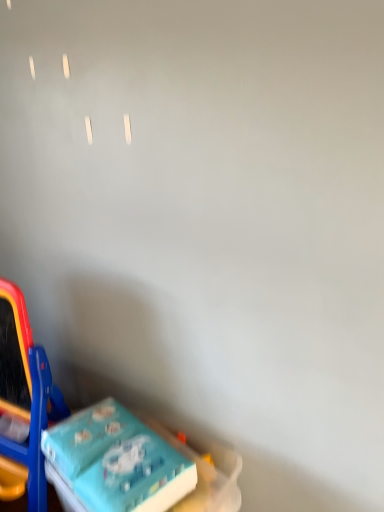
Question: Considering their positions, is blue plastic easel at lower left, which is the 2th toy in right-to-left order, located in front of or behind blue cardboard box at lower left, which appears as the second toy when viewed from the left?

Choices:
 (A) behind
 (B) front

Answer: (A)

Question: Visually, is blue plastic easel at lower left, arranged as the first toy when viewed from the left, positioned to the left or to the right of blue cardboard box at lower left, which appears as the second toy when viewed from the left?

Choices:
 (A) left
 (B) right

Answer: (A)

Question: Looking at the image, does blue plastic easel at lower left, arranged as the first toy when viewed from the left, seem bigger or smaller compared to blue cardboard box at lower left, which appears as the second toy when viewed from the left?

Choices:
 (A) small
 (B) big

Answer: (B)

Question: Considering their positions, is blue cardboard box at lower left, which appears as the second toy when viewed from the left, located in front of or behind blue plastic easel at lower left, arranged as the first toy when viewed from the left?

Choices:
 (A) behind
 (B) front

Answer: (B)

Question: From the image's perspective, is blue cardboard box at lower left, the 1th toy viewed from the right, positioned above or below blue plastic easel at lower left, which is the 2th toy in right-to-left order?

Choices:
 (A) above
 (B) below

Answer: (B)

Question: Is blue cardboard box at lower left, the 1th toy viewed from the right, bigger or smaller than blue plastic easel at lower left, which is the 2th toy in right-to-left order?

Choices:
 (A) small
 (B) big

Answer: (A)

Question: Considering the positions of blue cardboard box at lower left, the 1th toy viewed from the right, and blue plastic easel at lower left, which is the 2th toy in right-to-left order, in the image, is blue cardboard box at lower left, the 1th toy viewed from the right, taller or shorter than blue plastic easel at lower left, which is the 2th toy in right-to-left order,?

Choices:
 (A) tall
 (B) short

Answer: (B)